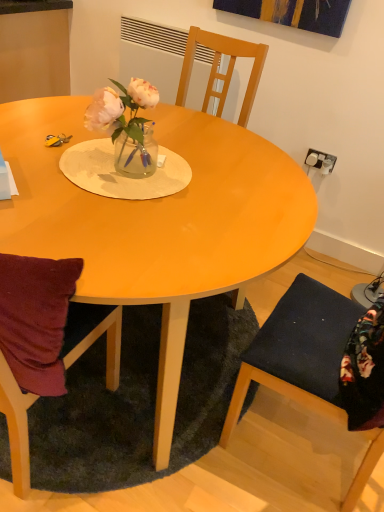
Locate an element on the screen. The height and width of the screenshot is (512, 384). free space in front of translucent glass vase at center is located at coordinates (111, 200).